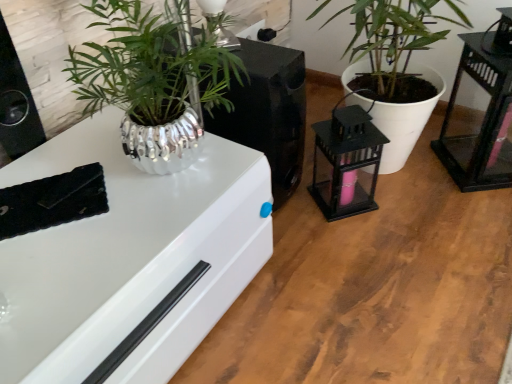
Question: Looking at their shapes, would you say black glass table at right is wider or thinner than white matte plant pot at center?

Choices:
 (A) thin
 (B) wide

Answer: (A)

Question: Does point (489, 33) appear closer or farther from the camera than point (394, 132)?

Choices:
 (A) farther
 (B) closer

Answer: (A)

Question: Which is farther from the white matte plant pot at center?

Choices:
 (A) metallic silver plant pot at upper left, acting as the 2th appliance starting from the right
 (B) black metal lantern at center-right, acting as the 2th appliance starting from the left
 (C) black glass table at right

Answer: (A)

Question: Which object is the closest to the white matte plant pot at center?

Choices:
 (A) black glass table at right
 (B) metallic silver plant pot at upper left, acting as the 2th appliance starting from the right
 (C) black metal lantern at center-right, acting as the 2th appliance starting from the left

Answer: (C)